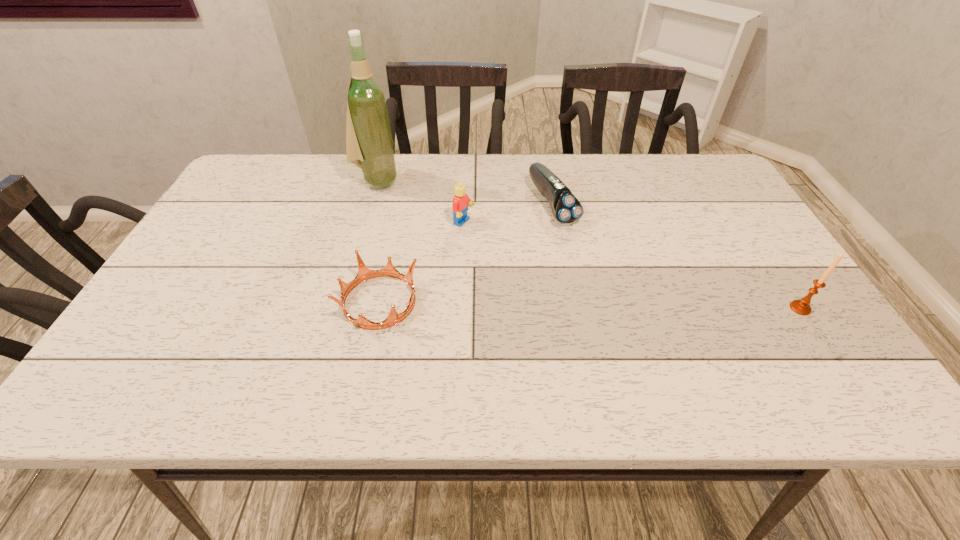
At what (x,y) coordinates should I click in order to perform the action: click on free space on the desktop that is between the crown and the fourth shortest object and is positioned on the face of the Lego. Please return your answer as a coordinate pair (x, y). Looking at the image, I should click on (645, 306).

Where is `free space on the desktop that is between the crown and the rightmost object and is positioned on the front-facing side of the wine bottle`? free space on the desktop that is between the crown and the rightmost object and is positioned on the front-facing side of the wine bottle is located at coordinates (526, 304).

Find the location of `vacant space on the desktop that is between the crown and the rightmost object and is positioned on the head of the second object from right to left`. vacant space on the desktop that is between the crown and the rightmost object and is positioned on the head of the second object from right to left is located at coordinates click(636, 306).